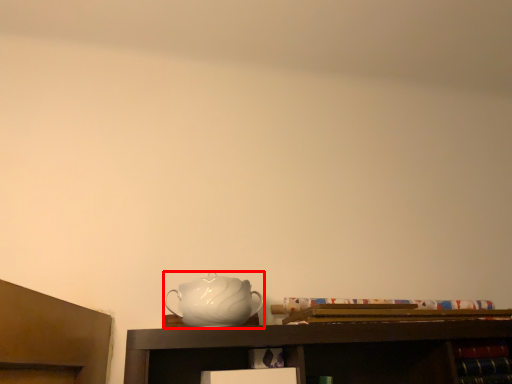
Question: In this image, where is jug (annotated by the red box) located relative to cabinet?

Choices:
 (A) right
 (B) left

Answer: (B)